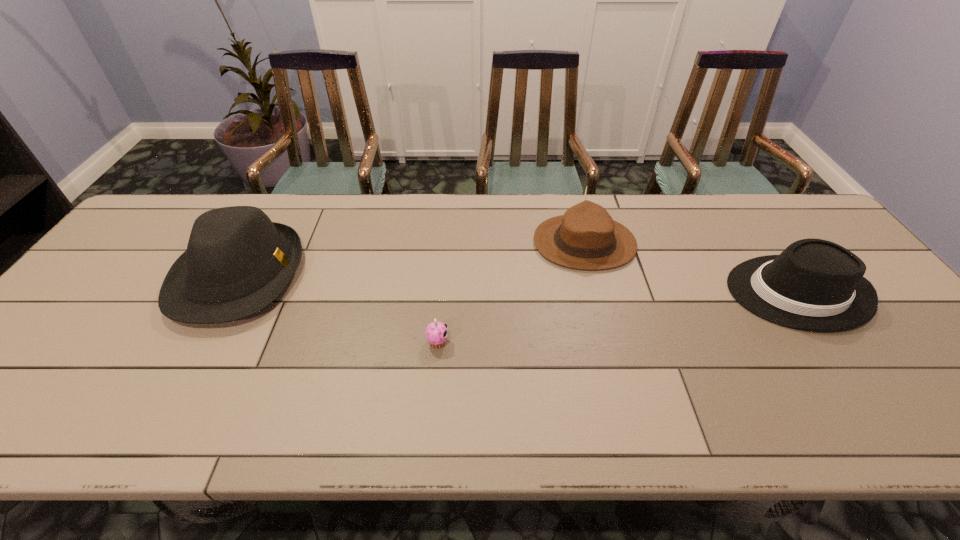
Locate an element on the screen. The height and width of the screenshot is (540, 960). free spot between the second fedora from left to right and the third object from right to left is located at coordinates (511, 293).

Locate an element on the screen. object identified as the third closest to the rightmost object is located at coordinates (237, 262).

The image size is (960, 540). In order to click on the closest object relative to the third object from left to right in this screenshot , I will do point(816,285).

Where is `the third closest fedora to the second object from left to right`? the third closest fedora to the second object from left to right is located at coordinates [x=816, y=285].

Image resolution: width=960 pixels, height=540 pixels. What are the coordinates of `fedora that is the closest to the rightmost fedora` in the screenshot? It's located at (586, 237).